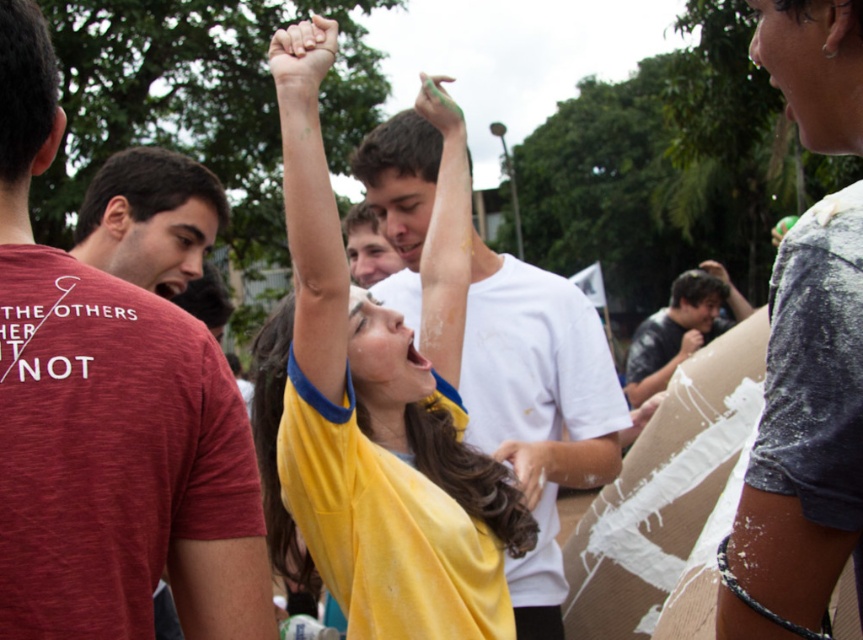
Question: Is maroon heathered t-shirt at left bigger than dark gray shirt at center?

Choices:
 (A) yes
 (B) no

Answer: (B)

Question: Considering the real-world distances, which object is farthest from the maroon heathered t-shirt at left?

Choices:
 (A) white matte shirt at upper right
 (B) yellow jersey at center
 (C) dark gray shirt at center

Answer: (C)

Question: Can you confirm if white matte shirt at upper right is smaller than dark gray shirt at center?

Choices:
 (A) yes
 (B) no

Answer: (A)

Question: Which object appears farthest from the camera in this image?

Choices:
 (A) white matte shirt at center
 (B) matte red t-shirt at left
 (C) yellow jersey at center

Answer: (B)

Question: Among these points, which one is nearest to the camera?

Choices:
 (A) (638, 371)
 (B) (846, 145)
 (C) (181, 253)

Answer: (B)

Question: Is matte red t-shirt at left below dark gray shirt at center?

Choices:
 (A) yes
 (B) no

Answer: (A)